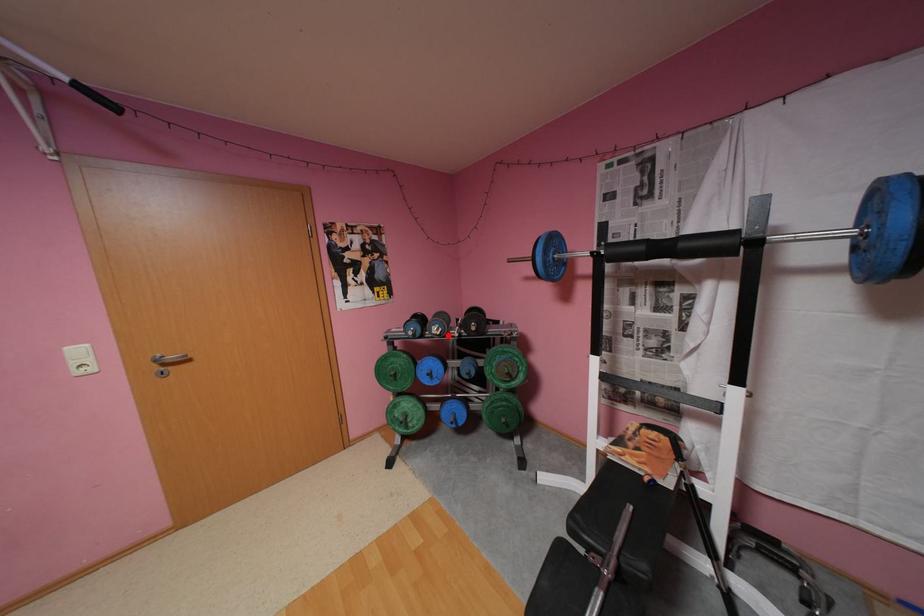
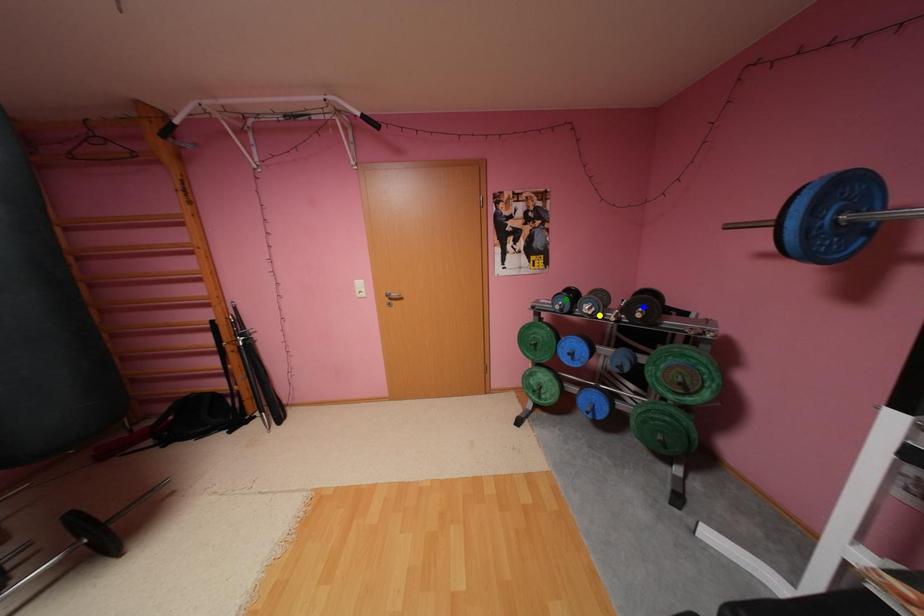
Question: I am providing you with two images of the same scene from different viewpoints. A red point is marked on the first image. You are given multiple points on the second image. Which mark in image 2 goes with the point in image 1?

Choices:
 (A) yellow point
 (B) green point
 (C) blue point

Answer: (A)